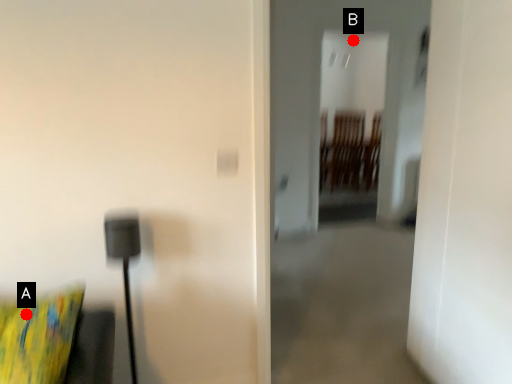
Question: Two points are circled on the image, labeled by A and B beside each circle. Which point is closer to the camera?

Choices:
 (A) A is closer
 (B) B is closer

Answer: (A)